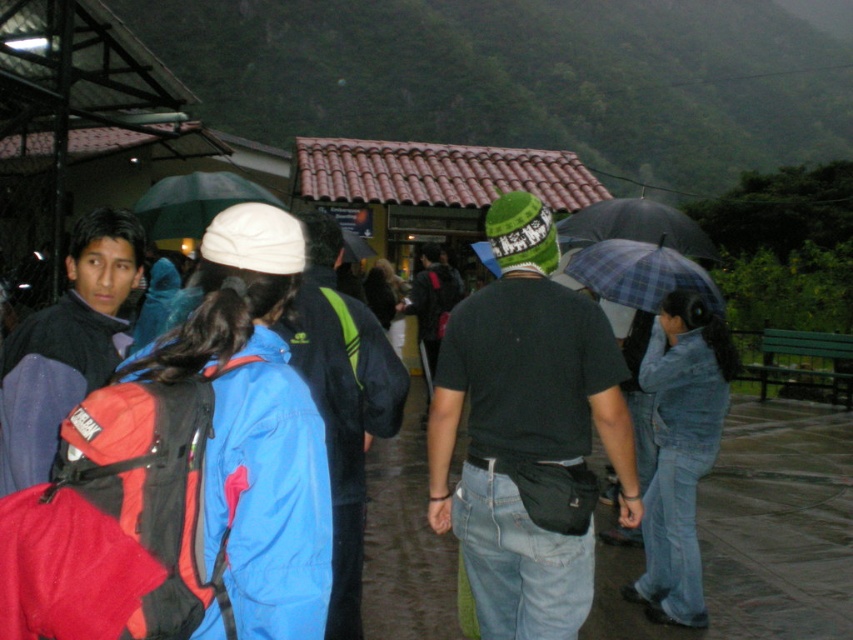
Question: Which point is closer to the camera?

Choices:
 (A) green matte umbrella at upper center
 (B) plaid fabric umbrella at right

Answer: (B)

Question: Does green matte umbrella at upper center come behind plaid fabric umbrella at center?

Choices:
 (A) no
 (B) yes

Answer: (B)

Question: Which point is closer to the camera?

Choices:
 (A) (674, 241)
 (B) (602, 262)

Answer: (B)

Question: Is the position of plaid fabric umbrella at right more distant than that of green matte umbrella at upper center?

Choices:
 (A) no
 (B) yes

Answer: (A)

Question: Which point is closer to the camera?

Choices:
 (A) plaid fabric umbrella at center
 (B) green matte umbrella at upper center
 (C) plaid fabric umbrella at right

Answer: (C)

Question: Does plaid fabric umbrella at right have a lesser width compared to green matte umbrella at upper center?

Choices:
 (A) no
 (B) yes

Answer: (B)